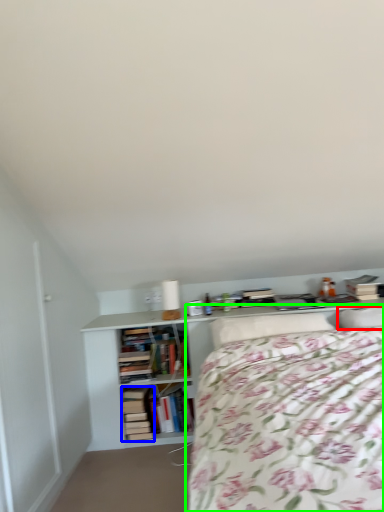
Question: Which is nearer to the pillow (highlighted by a red box)? book (highlighted by a blue box) or bed (highlighted by a green box).

Choices:
 (A) book
 (B) bed

Answer: (B)